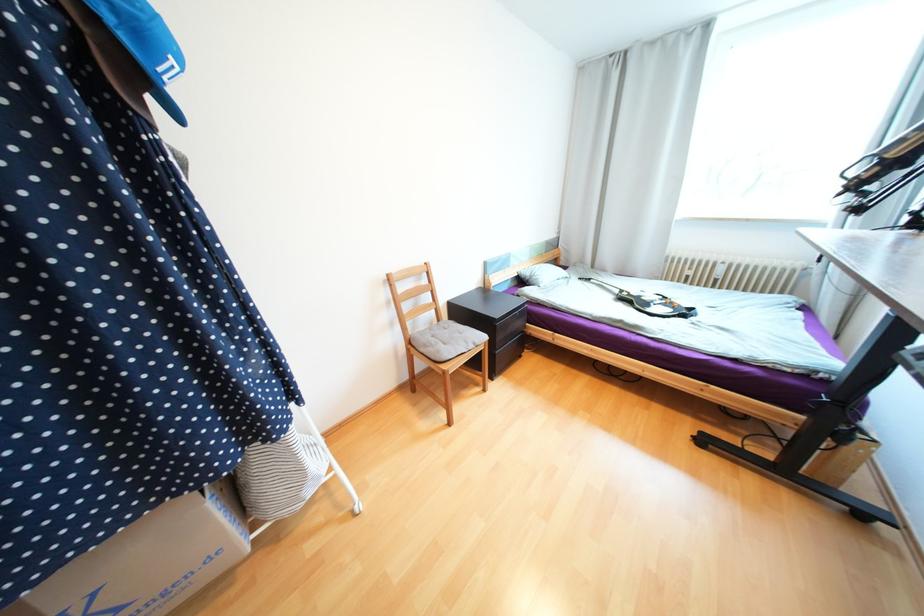
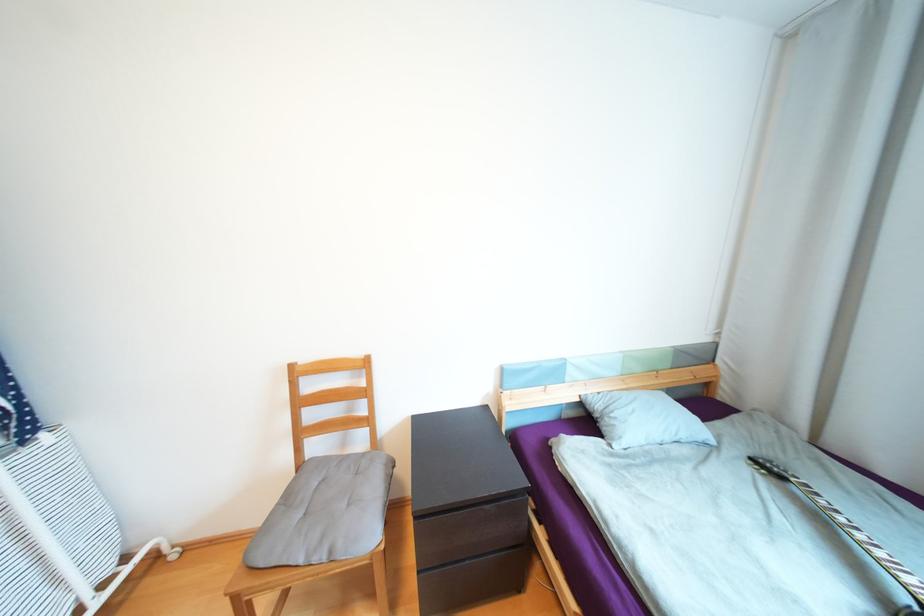
Where in the second image is the point corresponding to pixel 480 344 from the first image?

(335, 553)